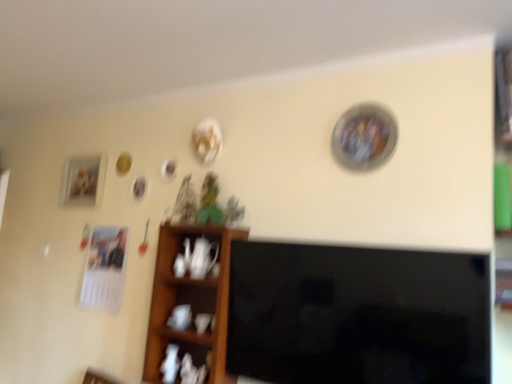
Describe the element at coordinates (83, 181) in the screenshot. The image size is (512, 384). I see `matte wooden picture frame at left` at that location.

Measure the distance between black glossy tv at center and camera.

black glossy tv at center is 4.24 feet away from camera.

The width and height of the screenshot is (512, 384). What are the coordinates of `matte wooden picture frame at left` in the screenshot? It's located at (83, 181).

Which of these two, black glossy tv at center or matte wooden picture frame at left, stands shorter?

With less height is matte wooden picture frame at left.

Is black glossy tv at center inside or outside of matte wooden picture frame at left?

black glossy tv at center cannot be found inside matte wooden picture frame at left.

From a real-world perspective, does black glossy tv at center stand above matte wooden picture frame at left?

No, from a real-world perspective, black glossy tv at center is not on top of matte wooden picture frame at left.

Identify the location of television below the matte wooden picture frame at left (from the image's perspective). The width and height of the screenshot is (512, 384). (357, 315).

Based on their sizes in the image, would you say wooden shelf at center is bigger or smaller than black glossy tv at center?

Clearly, wooden shelf at center is smaller in size than black glossy tv at center.

Can you tell me how much wooden shelf at center and black glossy tv at center differ in facing direction?

They differ by 1.77 degrees in their facing directions.

Consider the image. In terms of height, does wooden shelf at center look taller or shorter compared to black glossy tv at center?

wooden shelf at center is taller than black glossy tv at center.

Is wooden shelf at center surrounding black glossy tv at center?

Definitely not — black glossy tv at center is not inside wooden shelf at center.

Looking at this image, from the image's perspective, does matte wooden picture frame at left appear higher than black glossy tv at center?

Yes, from the image's perspective, matte wooden picture frame at left is on top of black glossy tv at center.

Does matte wooden picture frame at left have a larger size compared to black glossy tv at center?

No.

Does matte wooden picture frame at left appear on the right side of black glossy tv at center?

Incorrect, matte wooden picture frame at left is not on the right side of black glossy tv at center.

Does matte wooden picture frame at left appear on the left side of wooden shelf at center?

Yes.

Does matte wooden picture frame at left touch wooden shelf at center?

No, matte wooden picture frame at left is not in contact with wooden shelf at center.

Between matte wooden picture frame at left and wooden shelf at center, which one has larger width?

Wider between the two is wooden shelf at center.

In order to click on shelf in front of the matte wooden picture frame at left in this screenshot , I will do `click(190, 302)`.

Is wooden shelf at center further to the viewer compared to matte wooden picture frame at left?

No, it is not.

In the scene shown: Is wooden shelf at center positioned far away from matte wooden picture frame at left?

No, wooden shelf at center is not far from matte wooden picture frame at left.

From the picture: Is wooden shelf at center thinner than matte wooden picture frame at left?

No, wooden shelf at center is not thinner than matte wooden picture frame at left.

Between black glossy tv at center and wooden shelf at center, which one has smaller size?

Smaller between the two is wooden shelf at center.

In terms of height, does black glossy tv at center look taller or shorter compared to wooden shelf at center?

In the image, black glossy tv at center appears to be shorter than wooden shelf at center.

From a real-world perspective, is black glossy tv at center positioned above or below wooden shelf at center?

Clearly, from a real-world perspective, black glossy tv at center is above wooden shelf at center.

Is black glossy tv at center positioned beyond the bounds of wooden shelf at center?

Absolutely, black glossy tv at center is external to wooden shelf at center.

Identify the location of picture frame that appears on the left of black glossy tv at center. (83, 181).

I want to click on shelf that is below the black glossy tv at center (from the image's perspective), so click(190, 302).

Estimate the real-world distances between objects in this image. Which object is further from black glossy tv at center, matte wooden picture frame at left or wooden shelf at center?

matte wooden picture frame at left lies further to black glossy tv at center than the other object.

Based on their spatial positions, is wooden shelf at center or black glossy tv at center further from matte wooden picture frame at left?

black glossy tv at center.

From the image, which object appears to be farther from matte wooden picture frame at left, black glossy tv at center or wooden shelf at center?

The object further to matte wooden picture frame at left is black glossy tv at center.

Estimate the real-world distances between objects in this image. Which object is further from black glossy tv at center, wooden shelf at center or matte wooden picture frame at left?

matte wooden picture frame at left is positioned further to the anchor black glossy tv at center.

Looking at the image, which one is located closer to wooden shelf at center, matte wooden picture frame at left or black glossy tv at center?

black glossy tv at center.

Estimate the real-world distances between objects in this image. Which object is closer to wooden shelf at center, black glossy tv at center or matte wooden picture frame at left?

Among the two, black glossy tv at center is located nearer to wooden shelf at center.

Locate an element on the screen. Image resolution: width=512 pixels, height=384 pixels. shelf between matte wooden picture frame at left and black glossy tv at center from left to right is located at coordinates pyautogui.click(x=190, y=302).